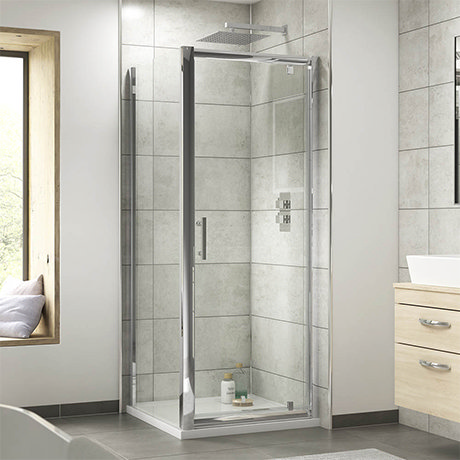
Locate an element on the screen. The height and width of the screenshot is (460, 460). shower is located at coordinates (220, 379).